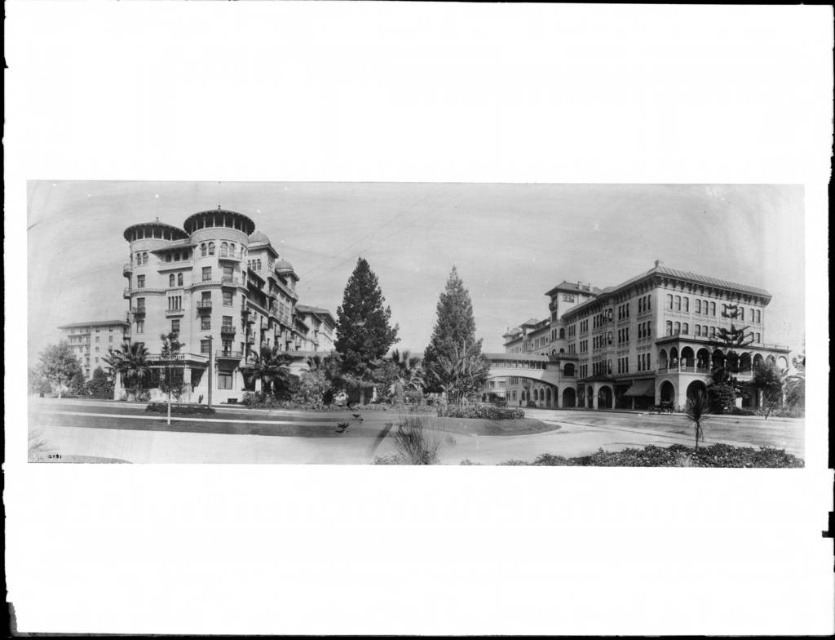
Question: Which point is closer to the camera?

Choices:
 (A) smooth white building at left
 (B) smooth tan building at center

Answer: (B)

Question: Can you confirm if smooth white building at left is positioned below smooth tan building at center?

Choices:
 (A) no
 (B) yes

Answer: (A)

Question: Can you confirm if smooth white building at left is smaller than smooth tan building at center?

Choices:
 (A) yes
 (B) no

Answer: (B)

Question: Which point is farther to the camera?

Choices:
 (A) (681, 324)
 (B) (272, 257)

Answer: (B)

Question: Is smooth white building at left to the left of smooth tan building at center from the viewer's perspective?

Choices:
 (A) no
 (B) yes

Answer: (B)